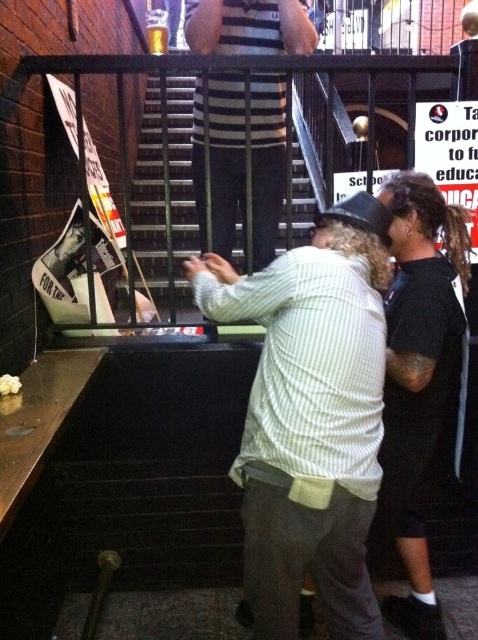
Question: Does striped shirt at center have a greater width compared to metal stairs at center?

Choices:
 (A) yes
 (B) no

Answer: (B)

Question: Can you confirm if white striped shirt at center is wider than striped shirt at center?

Choices:
 (A) no
 (B) yes

Answer: (B)

Question: Which of the following is the closest to the observer?

Choices:
 (A) (451, 241)
 (B) (278, 241)
 (C) (275, 426)
 (D) (228, 84)

Answer: (C)

Question: Among these objects, which one is nearest to the camera?

Choices:
 (A) striped shirt at center
 (B) white striped shirt at center

Answer: (B)

Question: Does white striped shirt at center appear over striped shirt at center?

Choices:
 (A) no
 (B) yes

Answer: (A)

Question: Which object is positioned farthest from the white striped shirt at center?

Choices:
 (A) metal stairs at center
 (B) striped shirt at center
 (C) black cotton shirt at center

Answer: (A)